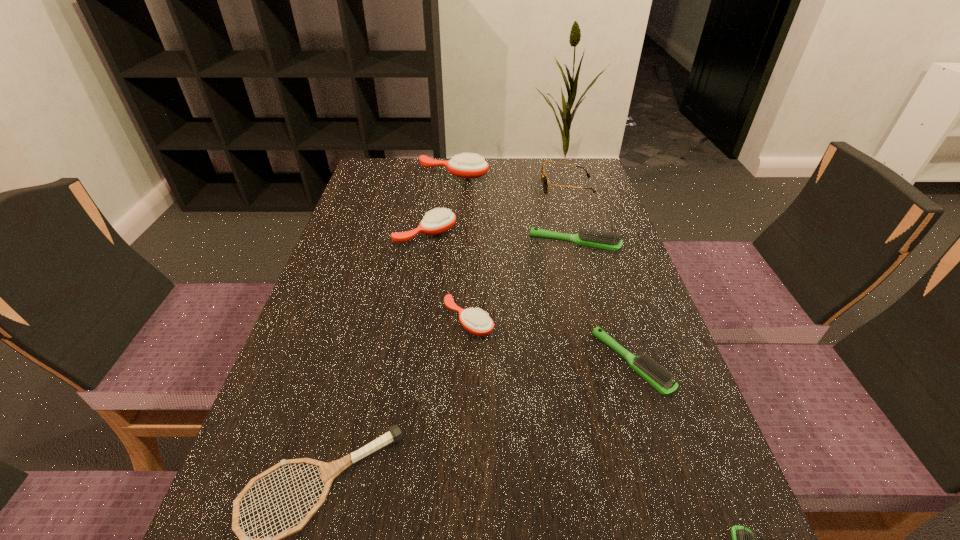
Locate an element on the screen. This screenshot has height=540, width=960. free region located 0.120m on the front-facing side of the black sunglasses is located at coordinates (501, 186).

Locate an element on the screen. The width and height of the screenshot is (960, 540). free space located 0.290m on the front-facing side of the black sunglasses is located at coordinates (444, 186).

Locate an element on the screen. This screenshot has width=960, height=540. blank space located on the front-facing side of the black sunglasses is located at coordinates (465, 186).

Locate an element on the screen. free space located 0.160m on the back of the second tallest hairbrush is located at coordinates (432, 190).

Identify the location of blank area located on the back of the farthest light hairbrush. Image resolution: width=960 pixels, height=540 pixels. tap(557, 177).

The height and width of the screenshot is (540, 960). In order to click on vacant region located on the back of the nearest orange hairbrush in this screenshot , I will do `click(471, 219)`.

This screenshot has height=540, width=960. Identify the location of vacant region located on the left of the second farthest light hairbrush. (395, 363).

You are a GUI agent. You are given a task and a screenshot of the screen. Output one action in this format:
    pyautogui.click(x=<x>, y=<y>)
    Task: Click on the hairbrush situated at the far edge
    Image resolution: width=960 pixels, height=540 pixels.
    Given the screenshot: What is the action you would take?
    pyautogui.click(x=469, y=165)

Identify the location of sunglasses that is at the far edge. This screenshot has height=540, width=960. (543, 177).

The image size is (960, 540). What are the coordinates of `object located at the left edge` in the screenshot? It's located at (440, 220).